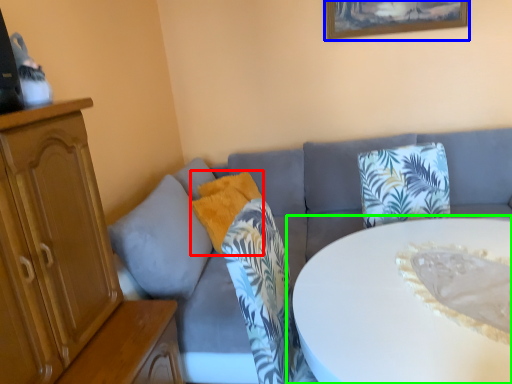
Question: Considering the real-world distances, which object is closest to pillow (highlighted by a red box)? picture frame (highlighted by a blue box) or table (highlighted by a green box).

Choices:
 (A) picture frame
 (B) table

Answer: (B)